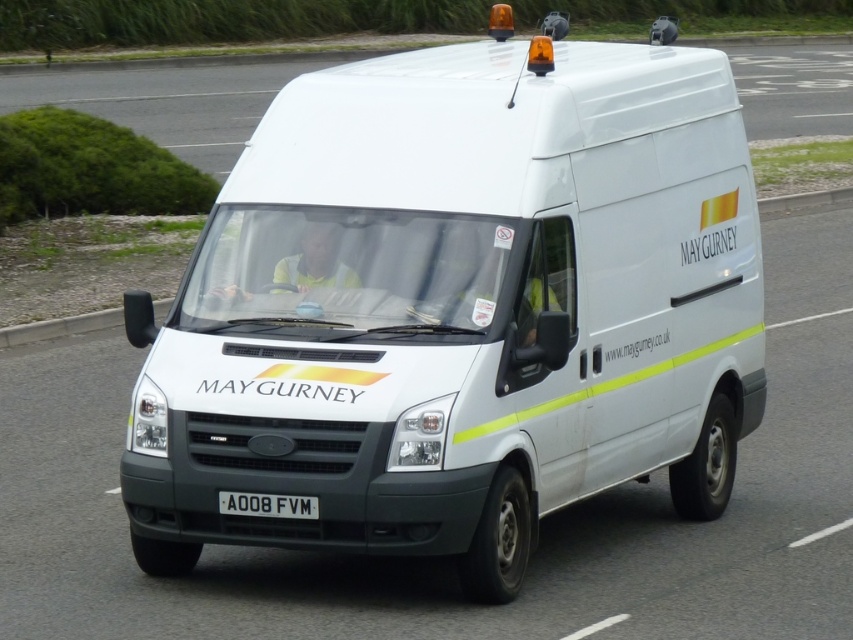
Question: Can you confirm if white matte van at center is positioned to the left of white glossy van at center?

Choices:
 (A) no
 (B) yes

Answer: (B)

Question: Which object appears farthest from the camera in this image?

Choices:
 (A) white glossy van at center
 (B) white matte van at center

Answer: (A)

Question: Which of the following is the farthest from the observer?

Choices:
 (A) white glossy van at center
 (B) black plastic license plate at center
 (C) white matte van at center

Answer: (A)

Question: Estimate the real-world distances between objects in this image. Which object is closer to the white glossy van at center?

Choices:
 (A) black plastic license plate at center
 (B) white matte van at center

Answer: (A)

Question: Is white matte van at center wider than black plastic license plate at center?

Choices:
 (A) yes
 (B) no

Answer: (B)

Question: Does white matte van at center appear over black plastic license plate at center?

Choices:
 (A) yes
 (B) no

Answer: (A)